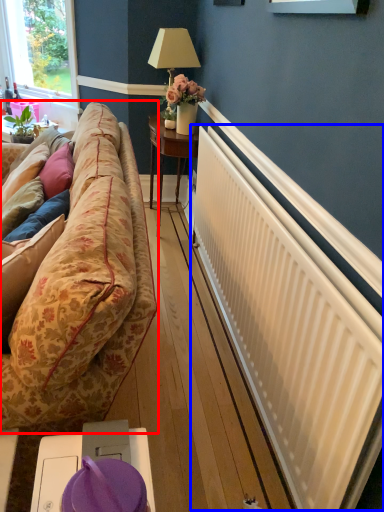
Question: Which object appears closest to the camera in this image, studio couch (highlighted by a red box) or radiator (highlighted by a blue box)?

Choices:
 (A) studio couch
 (B) radiator

Answer: (A)